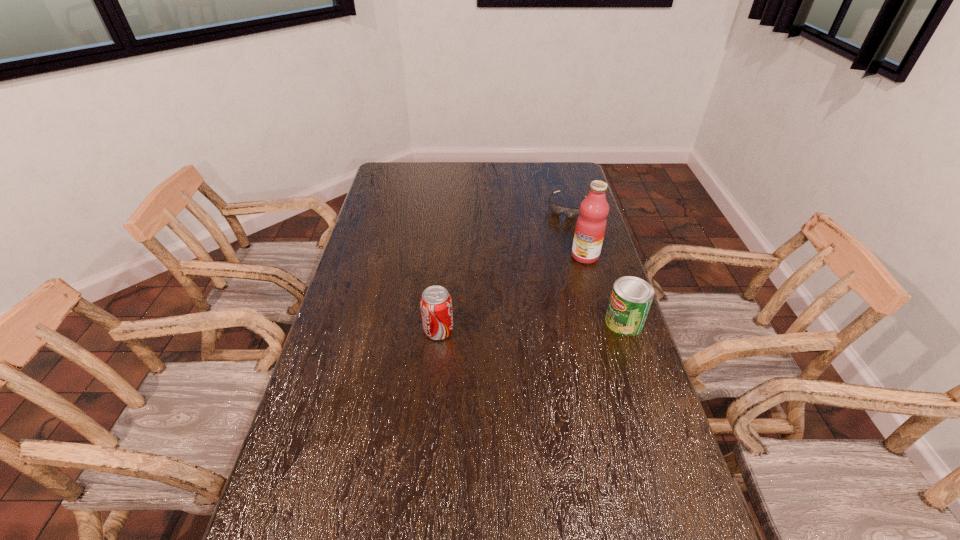
Locate which object ranks third in proximity to the goggles. Please provide its 2D coordinates. Your answer should be formatted as a tuple, i.e. [(x, y)], where the tuple contains the x and y coordinates of a point satisfying the conditions above.

[(436, 305)]

Choose which object is the nearest neighbor to the leftmost object. Please provide its 2D coordinates. Your answer should be formatted as a tuple, i.e. [(x, y)], where the tuple contains the x and y coordinates of a point satisfying the conditions above.

[(631, 297)]

The height and width of the screenshot is (540, 960). What are the coordinates of `vacant region that satisfies the following two spatial constraints: 1. on the front side of the can; 2. on the left side of the goggles` in the screenshot? It's located at (597, 322).

You are a GUI agent. You are given a task and a screenshot of the screen. Output one action in this format:
    pyautogui.click(x=<x>, y=<y>)
    Task: Click on the free space in the image that satisfies the following two spatial constraints: 1. on the back side of the shortest object; 2. on the right side of the soda
    The height and width of the screenshot is (540, 960).
    Given the screenshot: What is the action you would take?
    tap(450, 207)

The width and height of the screenshot is (960, 540). What are the coordinates of `free space in the image that satisfies the following two spatial constraints: 1. on the front side of the can; 2. on the left side of the shortest object` in the screenshot? It's located at (597, 322).

At what (x,y) coordinates should I click in order to perform the action: click on free space that satisfies the following two spatial constraints: 1. on the front side of the can; 2. on the left side of the shortest object. Please return your answer as a coordinate pair (x, y). The width and height of the screenshot is (960, 540). Looking at the image, I should click on [x=597, y=322].